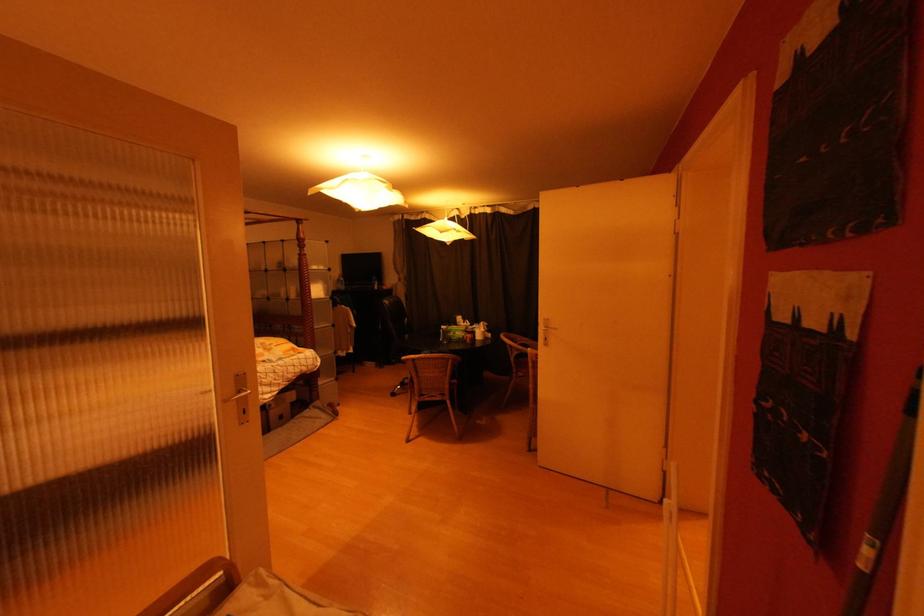
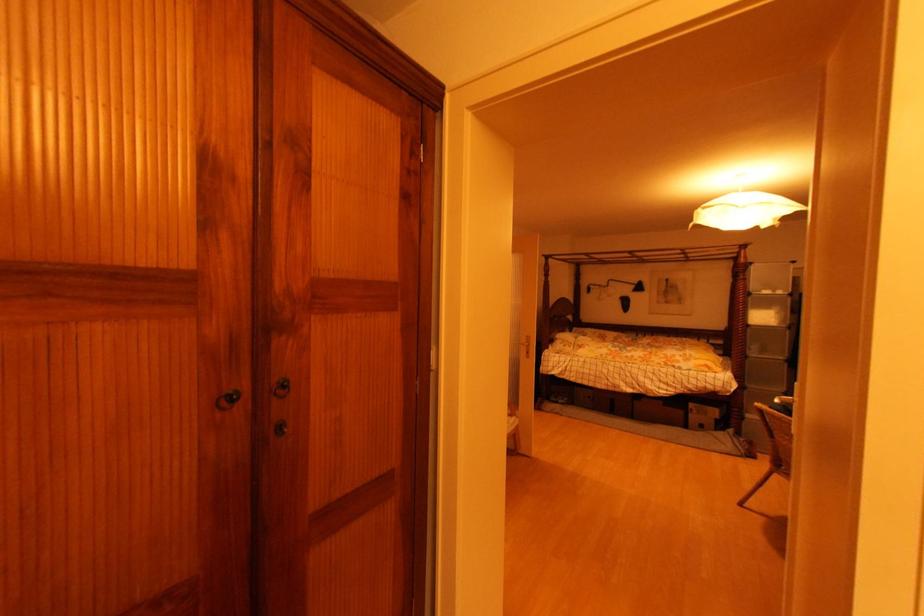
Where in the second image is the point corresponding to point (277, 408) from the first image?

(699, 413)